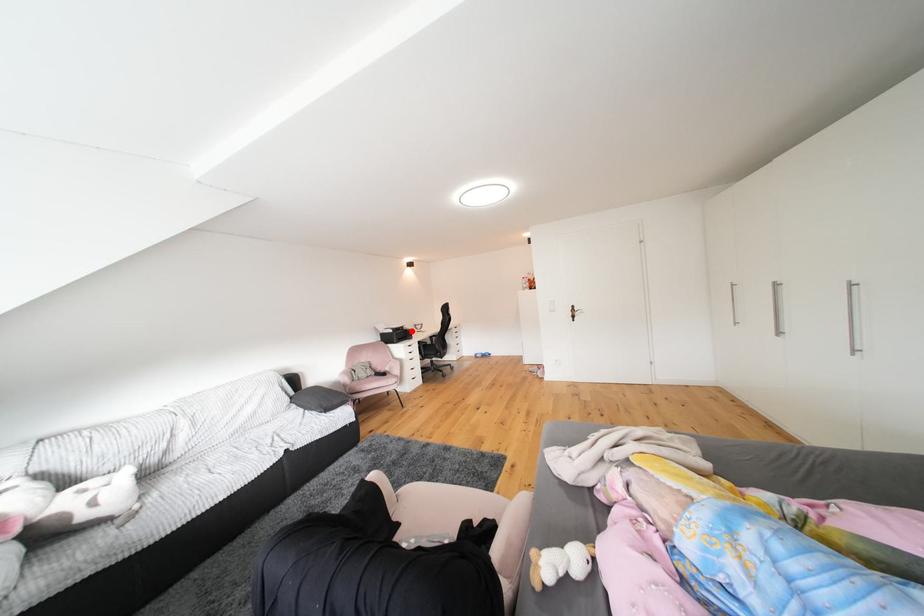
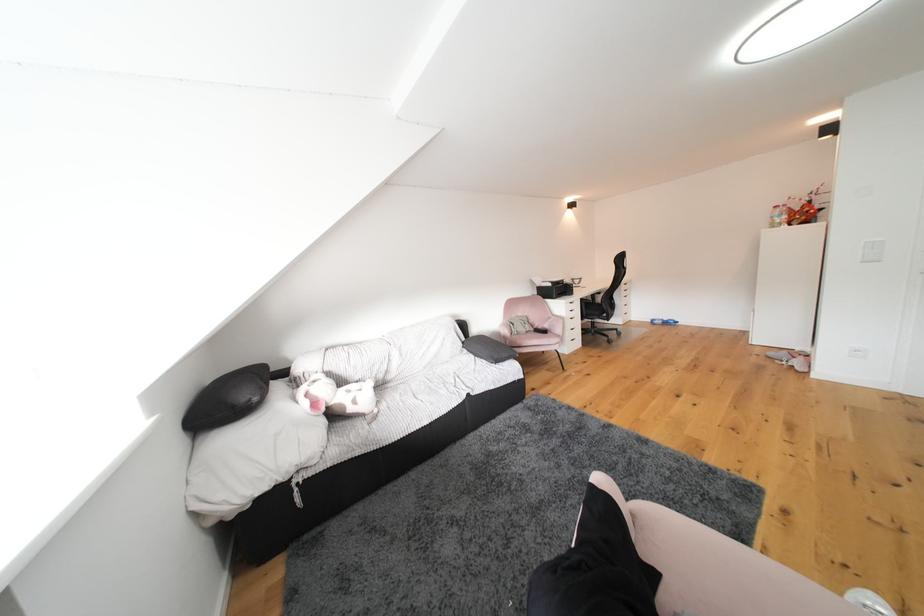
Question: I am providing you with two images of the same scene from different viewpoints. In image1, a red point is highlighted. Considering the same 3D point in image2, which of the following is correct?

Choices:
 (A) It is closer
 (B) It is farther

Answer: (B)